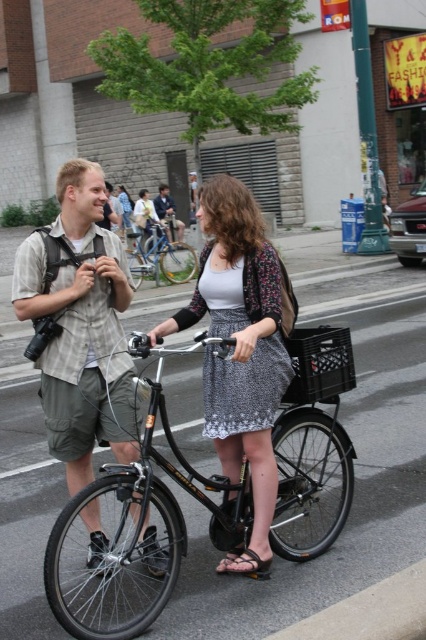
You are standing on the sidewalk and see two points marked in the image. The first point is at coordinates point (62,390) and the second is at point (143,499). Which point is closer to you?

Point (62,390) is closer to you because it is further to the viewer than point (143,499).

You are a delivery person who needs to pick up a package from a locker 10 feet away. You are currently standing in front of the black matte bicycle at center. Can you reach the locker without moving the bicycle?

The black matte bicycle at center is 8.68 feet away from you, so the locker is 1.32 feet beyond the bicycle. You can reach the locker without moving the bicycle.

You are a photographer trying to capture a candid shot of both the black matte bicycle at center and the denim jacket at center in the same frame. Based on their positions, which object should you focus on first to ensure both are in the frame?

The black matte bicycle at center is to the right of the denim jacket at center, so you should focus on the denim jacket at center first to ensure both are included in the frame.